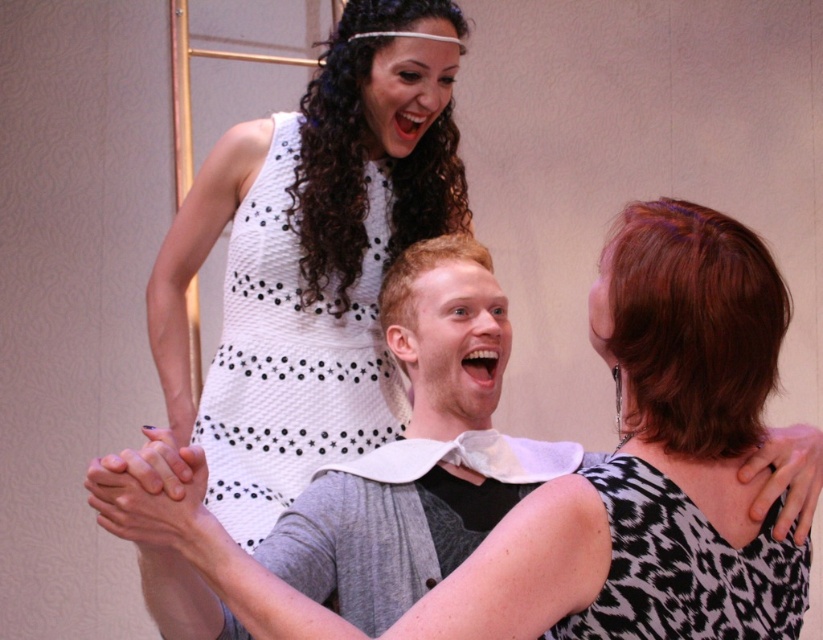
Question: Which object appears closest to the camera in this image?

Choices:
 (A) black and white printed dress at upper right
 (B) white dotted dress at upper center
 (C) white dotted fabric dress at upper center

Answer: (B)

Question: Does white dotted fabric dress at upper center appear on the left side of black and white printed dress at upper right?

Choices:
 (A) yes
 (B) no

Answer: (A)

Question: Which point appears closest to the camera in this image?

Choices:
 (A) (289, 580)
 (B) (382, 179)

Answer: (A)

Question: From the image, what is the correct spatial relationship of white dotted dress at upper center in relation to black and white printed dress at upper right?

Choices:
 (A) right
 (B) left

Answer: (B)

Question: Among these objects, which one is nearest to the camera?

Choices:
 (A) white dotted dress at upper center
 (B) white dotted fabric dress at upper center
 (C) black and white printed dress at upper right

Answer: (A)

Question: Is white dotted dress at upper center smaller than white dotted fabric dress at upper center?

Choices:
 (A) no
 (B) yes

Answer: (A)